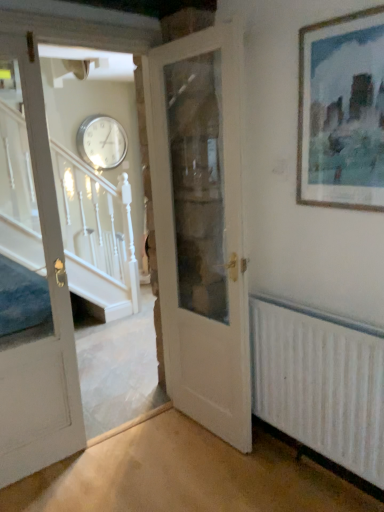
The height and width of the screenshot is (512, 384). What are the coordinates of `free space in front of white wooden door at center, the 2th door from the left` in the screenshot? It's located at (203, 475).